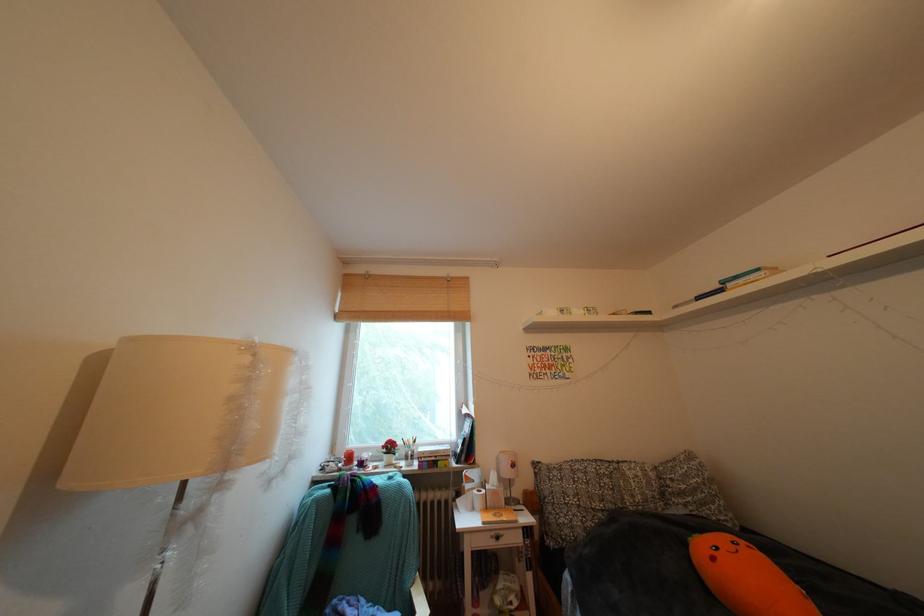
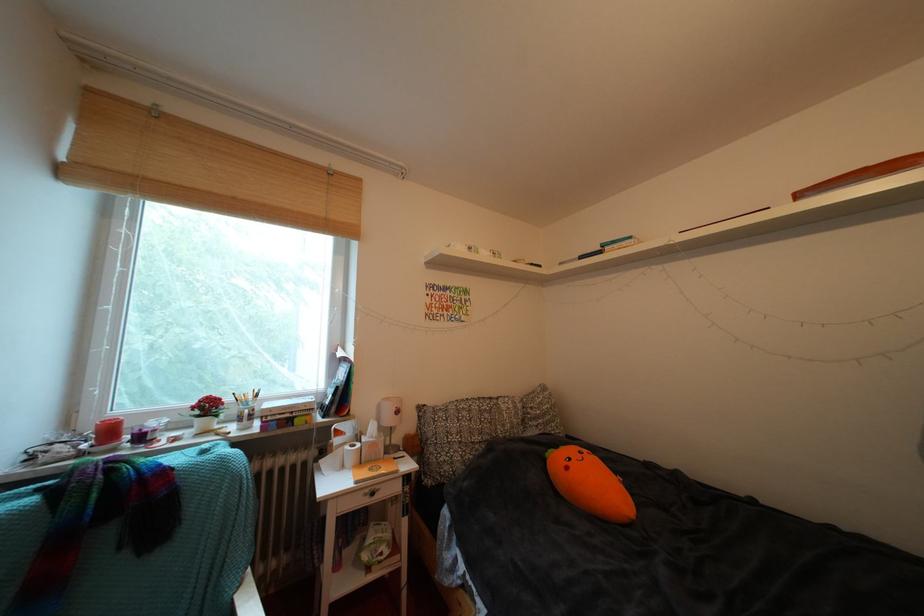
Question: In a continuous first-person perspective shot, in which direction is the camera moving?

Choices:
 (A) Left
 (B) Right
 (C) Forward
 (D) Backward

Answer: (C)